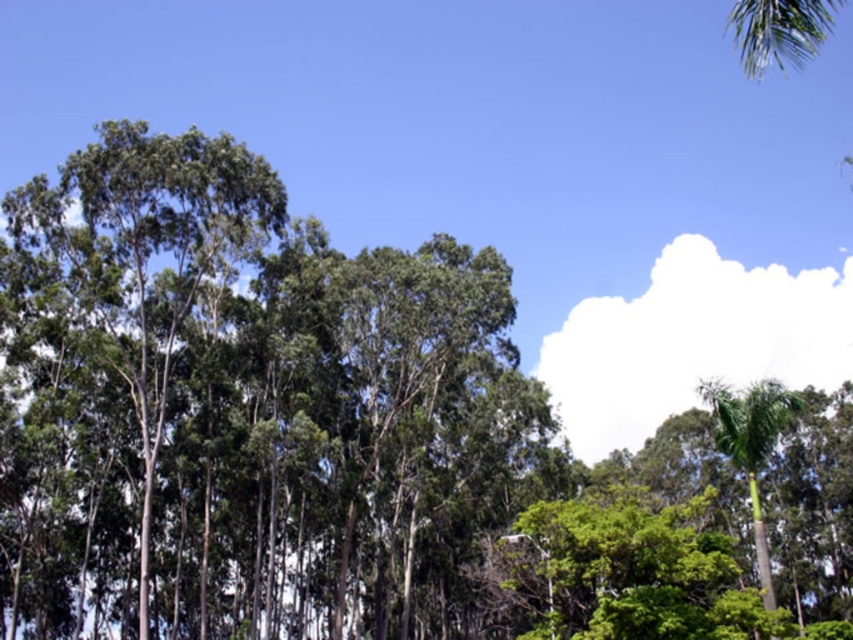
Based on the coordinates provided, what is located at point [248,410] in the image?

The point [248,410] indicates green leafy trees at center.

You are a bird flying over the forest and want to land on the closest tree. Which tree should you choose between the green leafy trees at center and the green leafy palm at right?

The green leafy trees at center are closer to you than the green leafy palm at right, so you should land on the green leafy trees at center.

You are a bird looking for a place to perch. You see the green leafy trees at center and the green leafy palm at right. Which one is closer to the ground?

The green leafy trees at center is positioned under the green leafy palm at right, so the green leafy trees at center is closer to the ground.